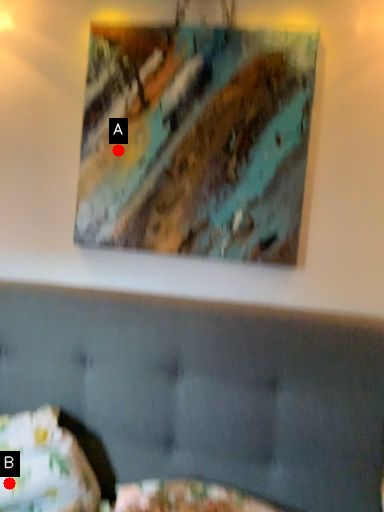
Question: Two points are circled on the image, labeled by A and B beside each circle. Which point is closer to the camera taking this photo?

Choices:
 (A) A is closer
 (B) B is closer

Answer: (B)